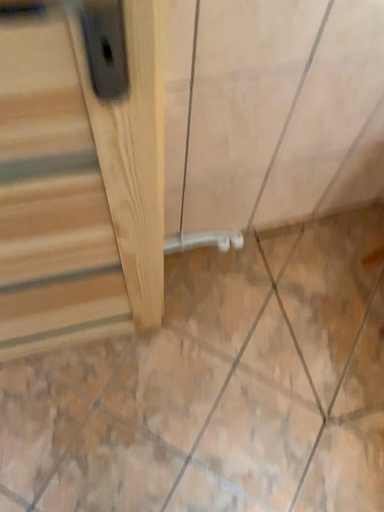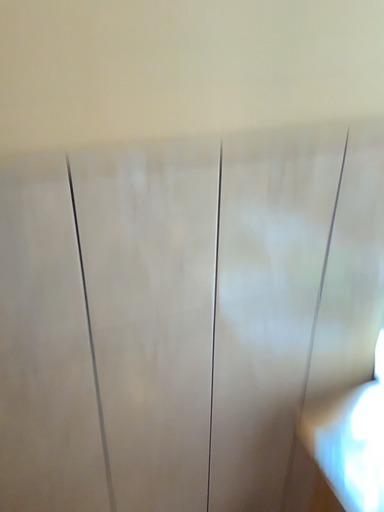
Question: Which way did the camera rotate in the video?

Choices:
 (A) rotated upward
 (B) rotated downward

Answer: (A)